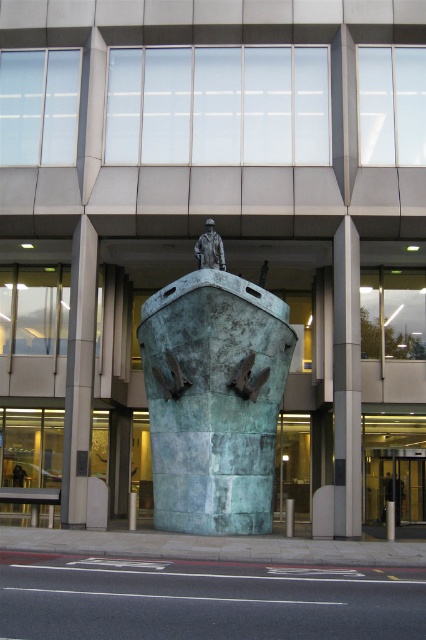
You are an architect examining the urban sculpture. You notice two pillars supporting the boat sculpture. The smooth gray pillar at center and the green patina pillar at center. Which pillar is taller?

The green patina pillar at center is taller than the smooth gray pillar at center.

You are an architect planning to place a new sculpture in a plaza. You have two options for the base of the sculpture. The first option is a smooth gray pillar at center, and the second option is a green patina pillar at center. Based on the scene, which base would allow for more space around it for visitors to walk around?

The green patina pillar at center occupies more space than the smooth gray pillar at center, so the green patina pillar at center would allow for more space around it for visitors to walk around.